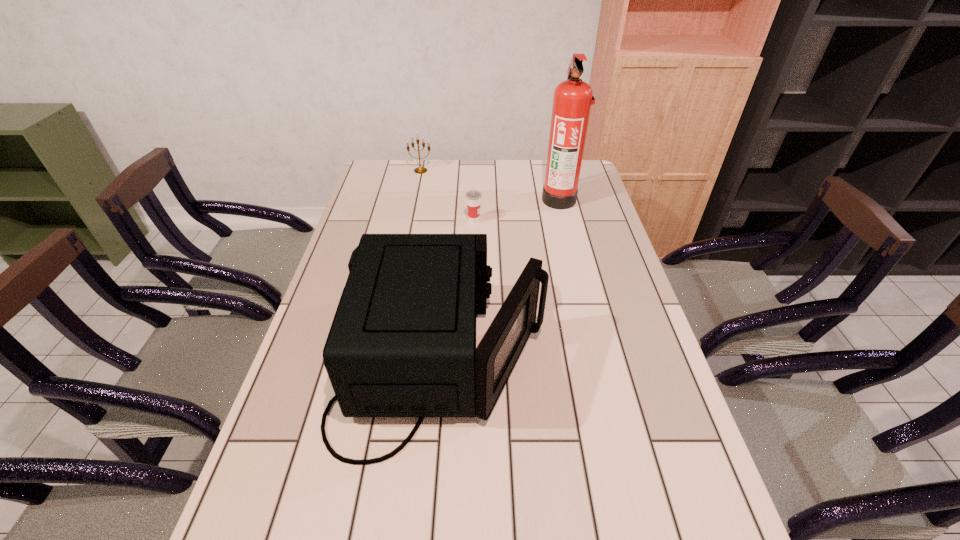
Locate an element on the screen. This screenshot has height=540, width=960. vacant region at the far edge of the desktop is located at coordinates (428, 168).

Locate an element on the screen. free space at the left edge of the desktop is located at coordinates (319, 324).

The width and height of the screenshot is (960, 540). In the image, there is a desktop. Identify the location of free space at the right edge. (600, 275).

In the image, there is a desktop. At what (x,y) coordinates should I click in order to perform the action: click on vacant space at the far left corner. Please return your answer as a coordinate pair (x, y). The image size is (960, 540). Looking at the image, I should click on (368, 185).

Where is `free spot between the tallest object and the third shortest object`? free spot between the tallest object and the third shortest object is located at coordinates (500, 281).

Find the location of `free space between the third shortest object and the tallest object`. free space between the third shortest object and the tallest object is located at coordinates (500, 281).

Locate an element on the screen. vacant space that is in between the rightmost object and the microwave oven is located at coordinates (500, 281).

At what (x,y) coordinates should I click in order to perform the action: click on free spot between the fire extinguisher and the farthest object. Please return your answer as a coordinate pair (x, y). This screenshot has height=540, width=960. Looking at the image, I should click on (490, 185).

The height and width of the screenshot is (540, 960). I want to click on free space between the third farthest object and the candelabrum, so click(x=447, y=195).

Find the location of a particular element. The image size is (960, 540). free space between the candelabrum and the fire extinguisher is located at coordinates (490, 185).